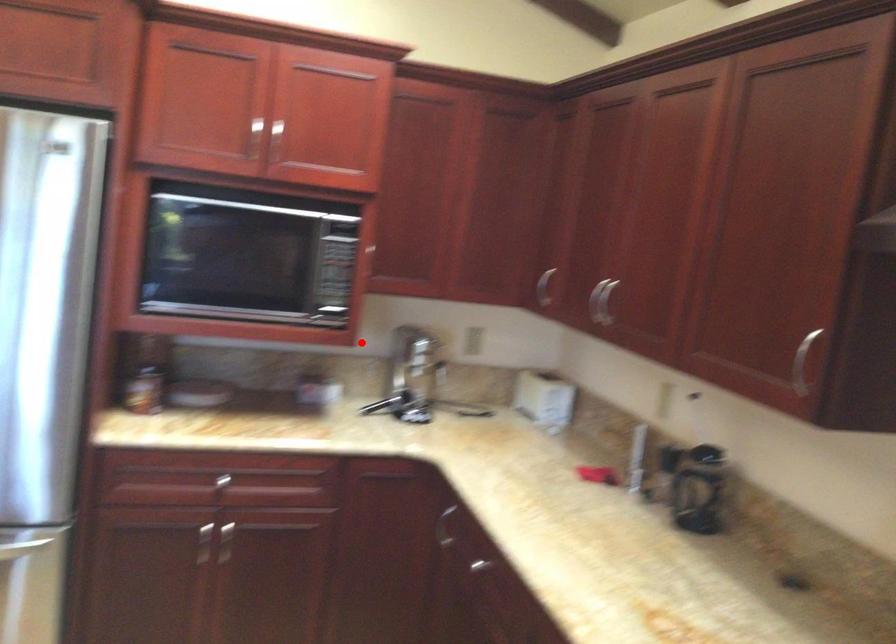
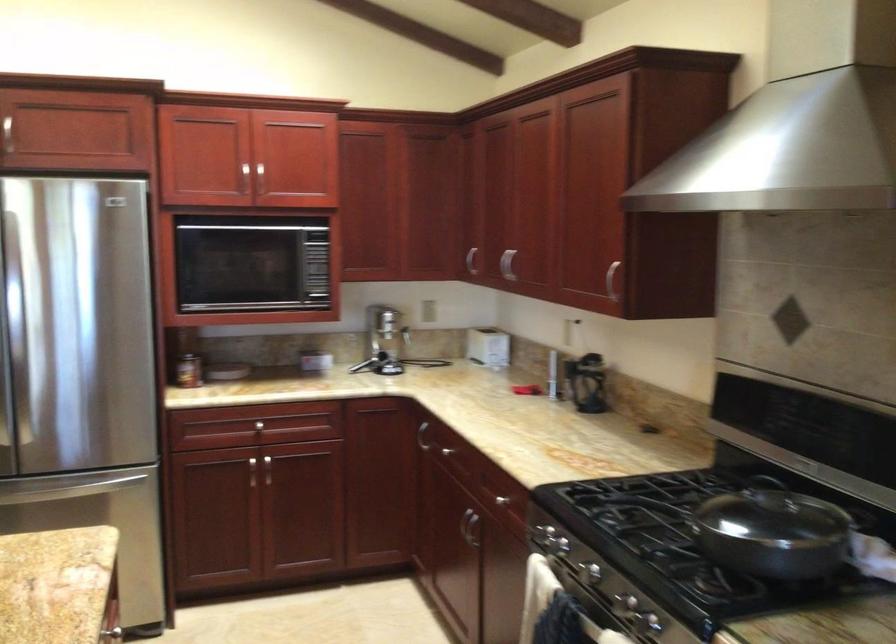
Locate, in the second image, the point that corresponds to the highlighted location in the first image.

(340, 322)